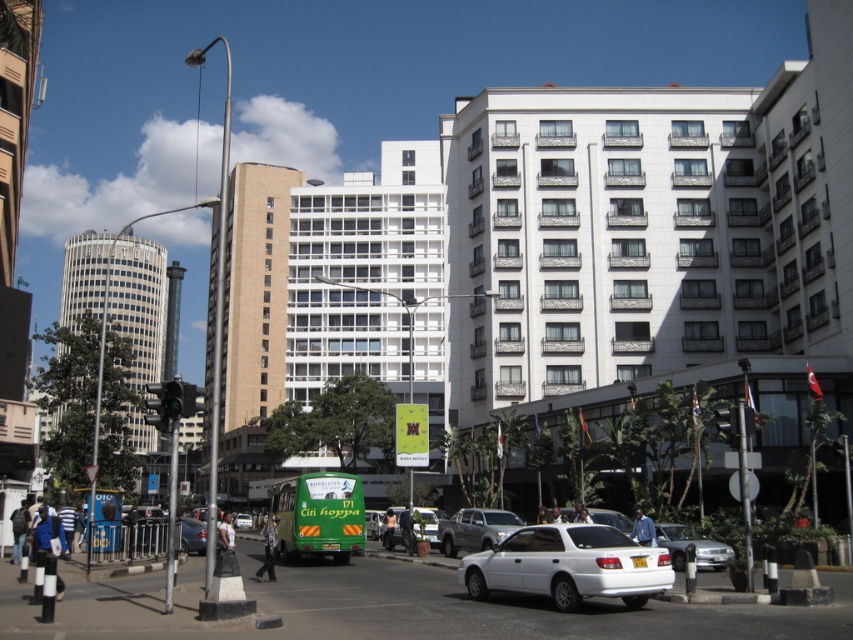
Between point (415, 515) and point (392, 525), which one is positioned in front?

Point (415, 515)

Is white glossy sedan at center thinner than skinny jeans at center?

No.

This screenshot has height=640, width=853. What are the coordinates of `white glossy sedan at center` in the screenshot? It's located at (392, 528).

Is blue shirt at center bigger than skinny jeans at center?

Correct, blue shirt at center is larger in size than skinny jeans at center.

Is the position of blue shirt at center less distant than that of skinny jeans at center?

Yes, blue shirt at center is in front of skinny jeans at center.

Is point (634, 529) behind point (386, 525)?

That is False.

The height and width of the screenshot is (640, 853). What are the coordinates of `blue shirt at center` in the screenshot? It's located at (643, 529).

Between green matte bus at center and dark skin human at center, which one has more height?

Standing taller between the two is dark skin human at center.

How far apart are green matte bus at center and dark skin human at center?

They are 48.12 meters apart.

Locate an element on the screen. This screenshot has width=853, height=640. green matte bus at center is located at coordinates (242, 522).

Locate an element on the screen. The height and width of the screenshot is (640, 853). green matte bus at center is located at coordinates (242, 522).